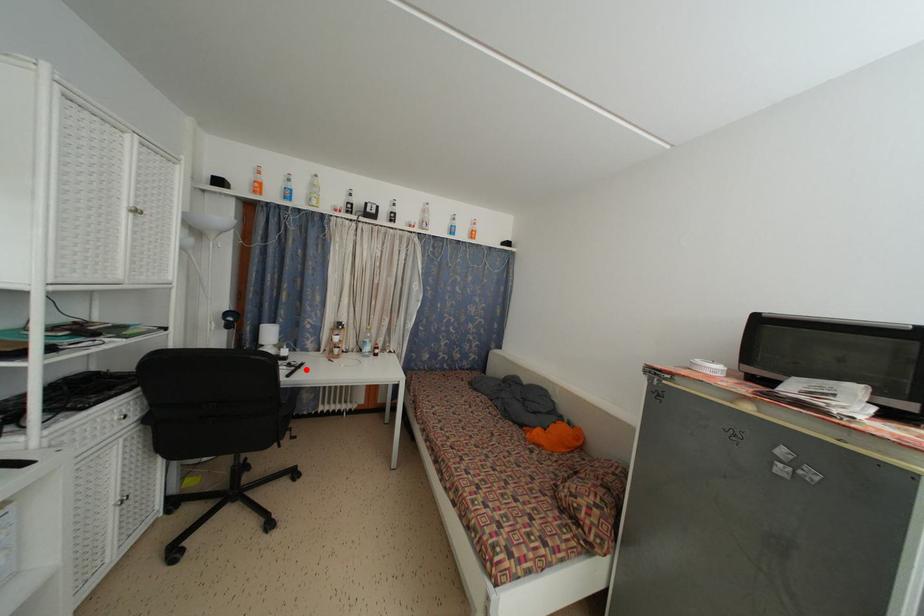
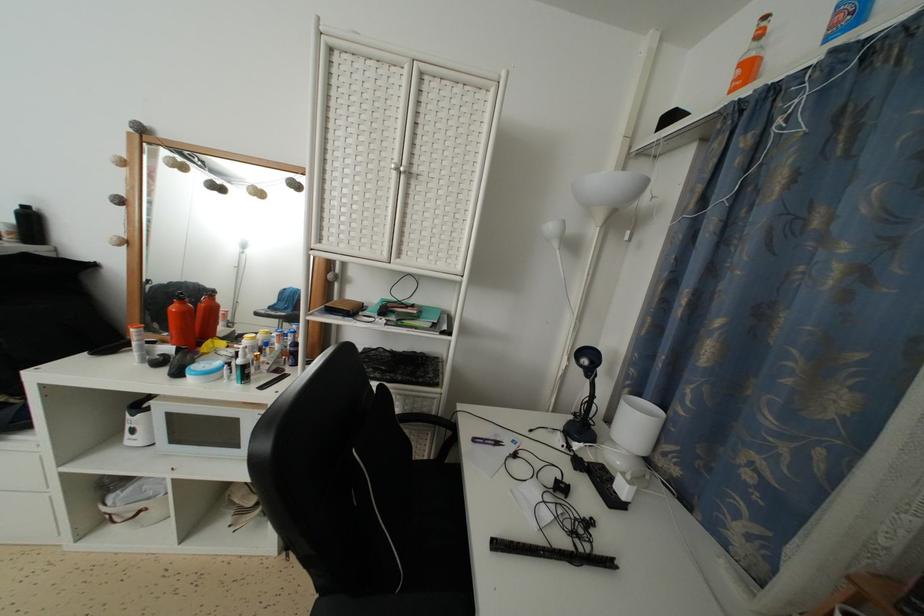
Question: I am providing you with two images of the same scene from different viewpoints. A red point is marked on the first image. Can you still see the location of the red point in image 2?

Choices:
 (A) Yes
 (B) No

Answer: (A)